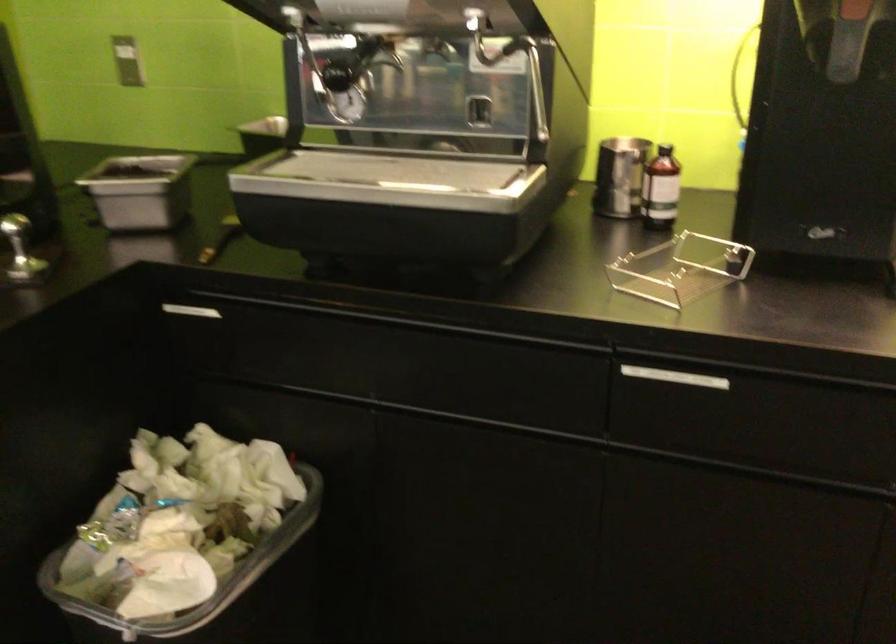
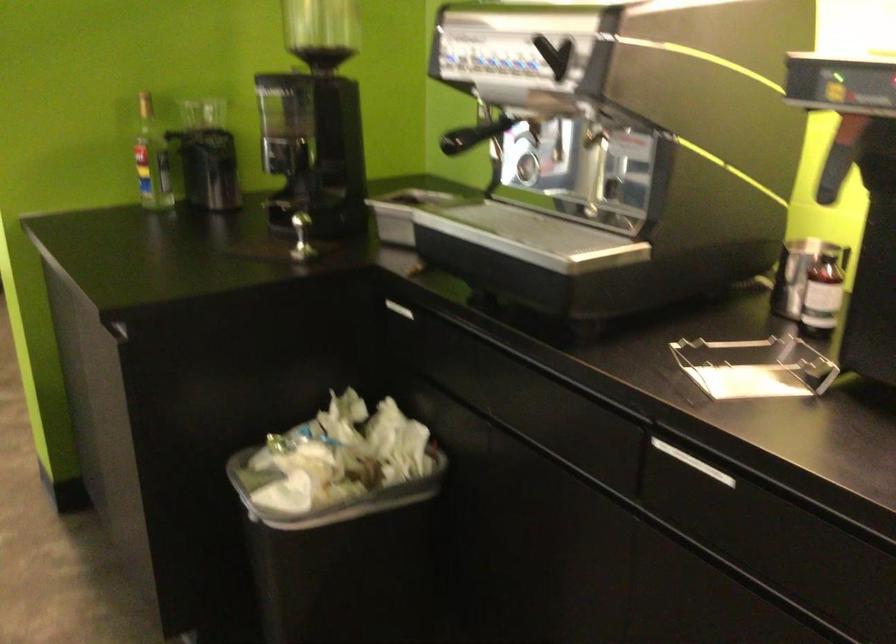
Question: The camera is either moving clockwise (left) or counter-clockwise (right) around the object. The first image is from the beginning of the video and the second image is from the end. Is the camera moving left or right when shooting the video?

Choices:
 (A) Left
 (B) Right

Answer: (B)